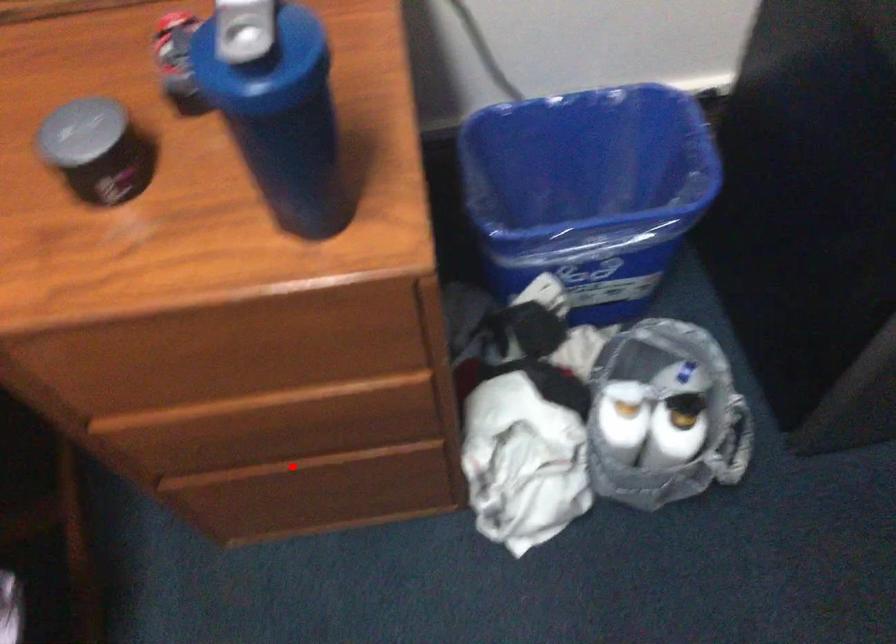
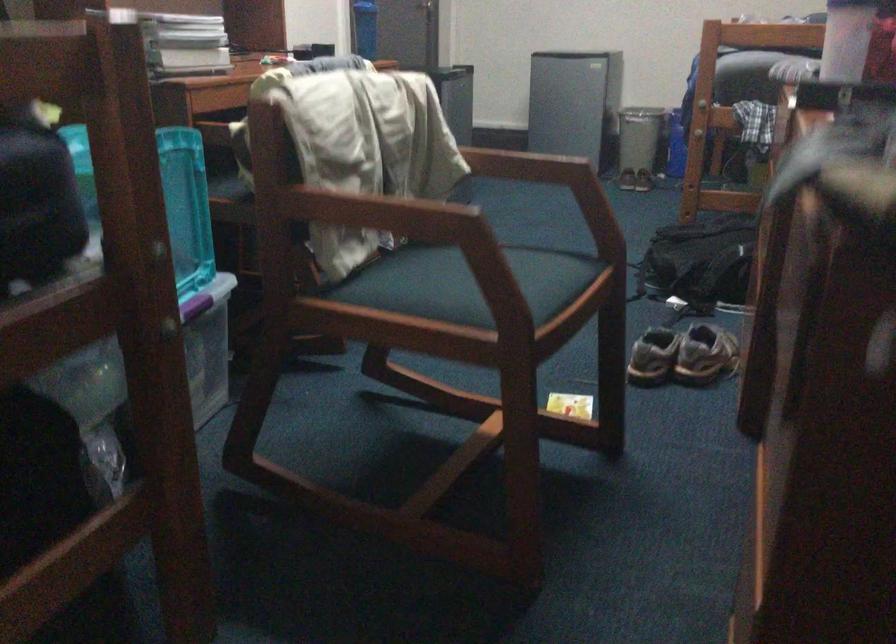
Question: I am providing you with two images of the same scene from different viewpoints. A red point is marked on the first image. At the location where the point appears in image 1, is it still visible in image 2?

Choices:
 (A) Yes
 (B) No

Answer: (B)